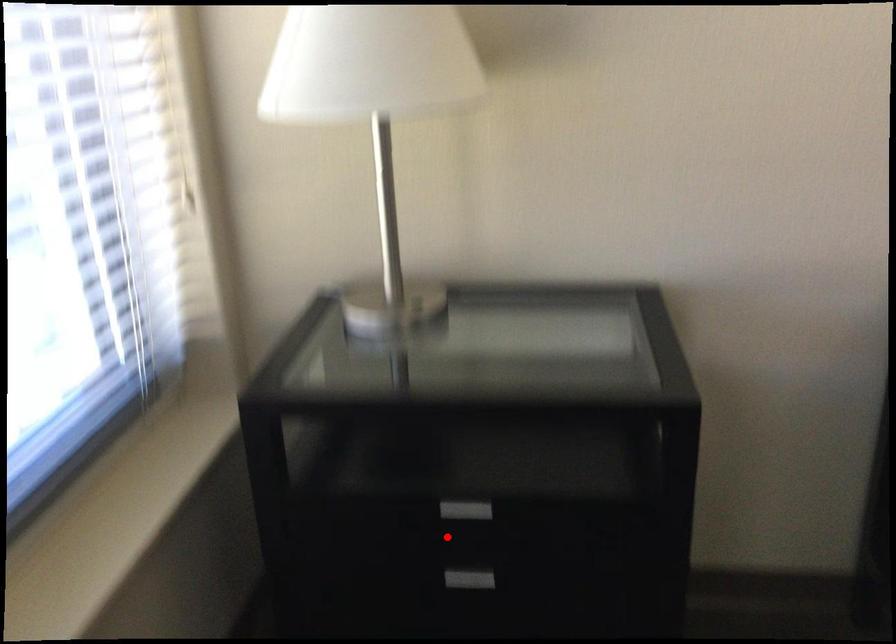
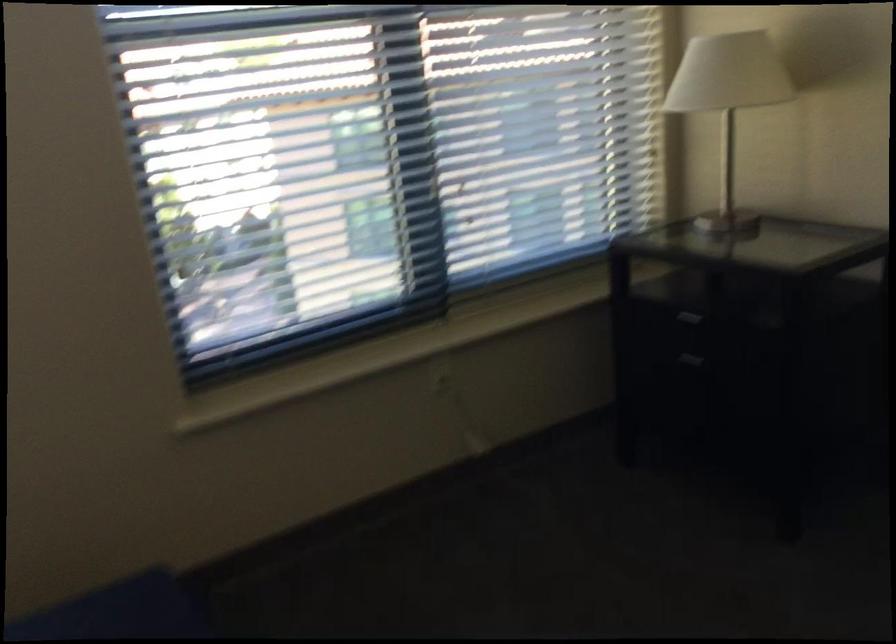
Question: I am providing you with two images of the same scene from different viewpoints. A red point is shown in image1. For the corresponding object point in image2, is it positioned nearer or farther from the camera?

Choices:
 (A) Nearer
 (B) Farther

Answer: (B)